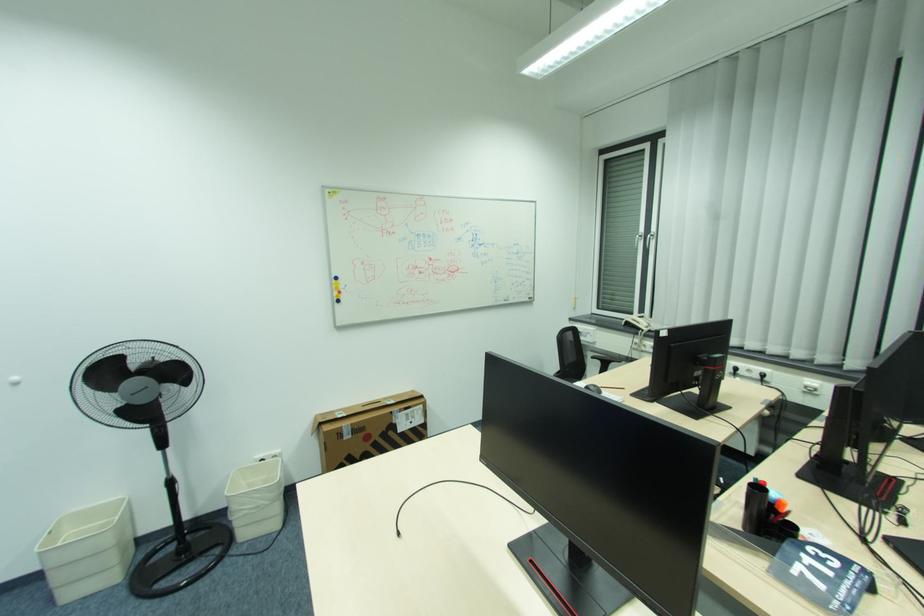
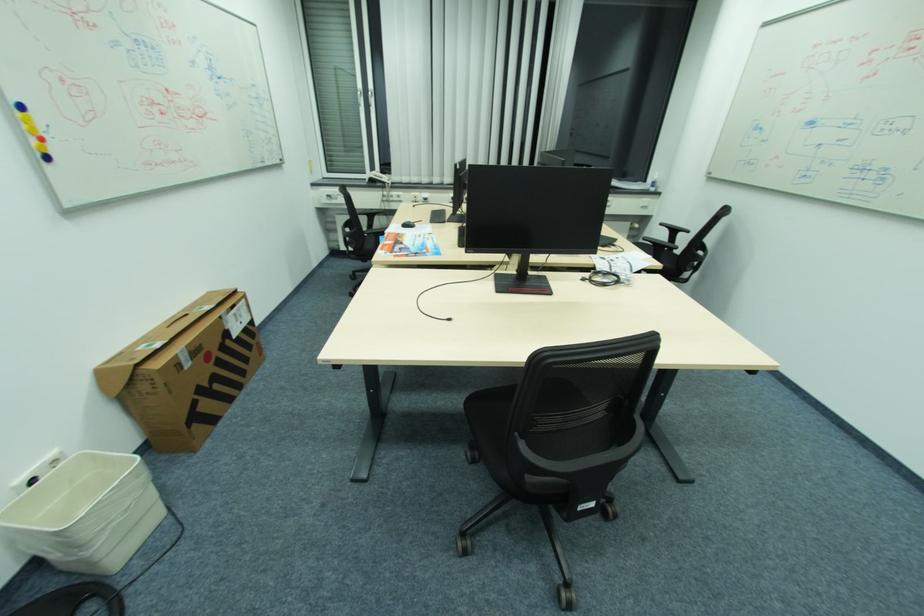
In the second image, find the point that corresponds to the point at 344,301 in the first image.

(52, 158)